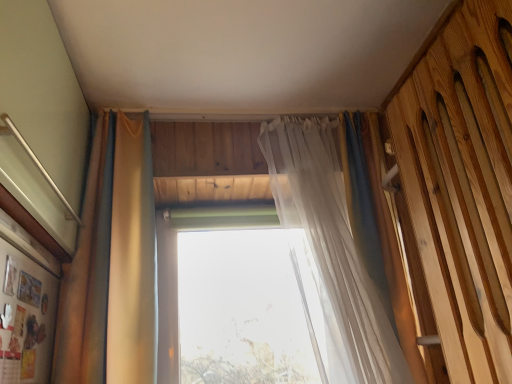
Question: From a real-world perspective, does matte gold curtain at left, placed as the first curtain when sorted from left to right, stand above translucent fabric curtain at center, placed as the 1th curtain when sorted from right to left?

Choices:
 (A) yes
 (B) no

Answer: (A)

Question: From a real-world perspective, is matte gold curtain at left, placed as the first curtain when sorted from left to right, physically below translucent fabric curtain at center, placed as the 1th curtain when sorted from right to left?

Choices:
 (A) no
 (B) yes

Answer: (A)

Question: Is translucent fabric curtain at center, positioned as the second curtain in left-to-right order, surrounded by matte gold curtain at left, placed as the first curtain when sorted from left to right?

Choices:
 (A) no
 (B) yes

Answer: (A)

Question: Is matte gold curtain at left, which is the 2th curtain from right to left, closer to camera compared to translucent fabric curtain at center, placed as the 1th curtain when sorted from right to left?

Choices:
 (A) yes
 (B) no

Answer: (A)

Question: Are matte gold curtain at left, which is the 2th curtain from right to left, and translucent fabric curtain at center, positioned as the second curtain in left-to-right order, beside each other?

Choices:
 (A) no
 (B) yes

Answer: (A)

Question: From the image's perspective, is translucent fabric curtain at center, positioned as the second curtain in left-to-right order, located above or below matte gold curtain at left, placed as the first curtain when sorted from left to right?

Choices:
 (A) above
 (B) below

Answer: (B)

Question: From their relative heights in the image, would you say translucent fabric curtain at center, positioned as the second curtain in left-to-right order, is taller or shorter than matte gold curtain at left, placed as the first curtain when sorted from left to right?

Choices:
 (A) tall
 (B) short

Answer: (A)

Question: From a real-world perspective, is translucent fabric curtain at center, placed as the 1th curtain when sorted from right to left, above or below matte gold curtain at left, placed as the first curtain when sorted from left to right?

Choices:
 (A) below
 (B) above

Answer: (A)

Question: Is translucent fabric curtain at center, placed as the 1th curtain when sorted from right to left, to the left or to the right of matte gold curtain at left, placed as the first curtain when sorted from left to right, in the image?

Choices:
 (A) right
 (B) left

Answer: (A)

Question: From a real-world perspective, relative to transparent glass window at center, is wooden slats bed at right vertically above or below?

Choices:
 (A) above
 (B) below

Answer: (B)

Question: Is wooden slats bed at right spatially inside transparent glass window at center, or outside of it?

Choices:
 (A) inside
 (B) outside

Answer: (B)

Question: Is wooden slats bed at right in front of or behind transparent glass window at center in the image?

Choices:
 (A) behind
 (B) front

Answer: (B)

Question: Does point (410, 157) appear closer or farther from the camera than point (249, 370)?

Choices:
 (A) farther
 (B) closer

Answer: (B)

Question: From a real-world perspective, is matte gold curtain at left, which is the 2th curtain from right to left, above or below translucent fabric curtain at center, positioned as the second curtain in left-to-right order?

Choices:
 (A) above
 (B) below

Answer: (A)

Question: Considering the positions of matte gold curtain at left, which is the 2th curtain from right to left, and translucent fabric curtain at center, placed as the 1th curtain when sorted from right to left, in the image, is matte gold curtain at left, which is the 2th curtain from right to left, wider or thinner than translucent fabric curtain at center, placed as the 1th curtain when sorted from right to left,?

Choices:
 (A) thin
 (B) wide

Answer: (A)